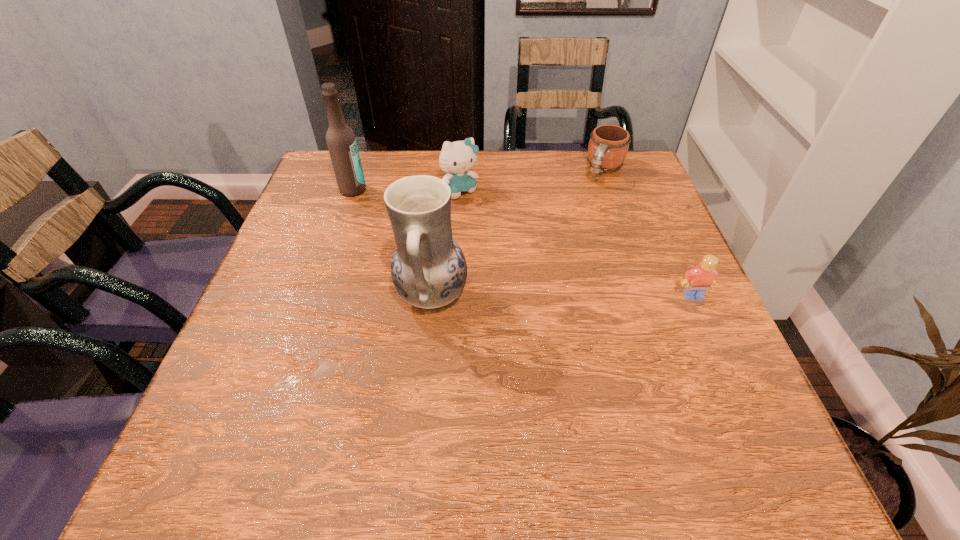
Locate an element on the screen. This screenshot has height=540, width=960. vacant region located 0.380m on the label of the beer bottle is located at coordinates (471, 260).

Locate an element on the screen. This screenshot has height=540, width=960. blank area located on the label of the beer bottle is located at coordinates (x=396, y=215).

Where is `free point located 0.100m on the label of the beer bottle`? This screenshot has width=960, height=540. free point located 0.100m on the label of the beer bottle is located at coordinates point(387,210).

Locate an element on the screen. vacant space located on the side of the mug with the handle is located at coordinates (554, 258).

The width and height of the screenshot is (960, 540). Find the location of `vacant region located 0.100m on the side of the mug with the handle`. vacant region located 0.100m on the side of the mug with the handle is located at coordinates (588, 204).

Where is `vacant area situated on the side of the mug with the handle`? This screenshot has width=960, height=540. vacant area situated on the side of the mug with the handle is located at coordinates (580, 217).

You are a GUI agent. You are given a task and a screenshot of the screen. Output one action in this format:
    pyautogui.click(x=<x>, y=<y>)
    Task: Click on the kitten that is at the far edge
    
    Given the screenshot: What is the action you would take?
    pyautogui.click(x=457, y=157)

Where is `beer bottle positioned at the far edge`? beer bottle positioned at the far edge is located at coordinates (341, 141).

Where is `mug that is positioned at the far edge`? Image resolution: width=960 pixels, height=540 pixels. mug that is positioned at the far edge is located at coordinates (608, 146).

I want to click on object that is positioned at the left edge, so click(341, 141).